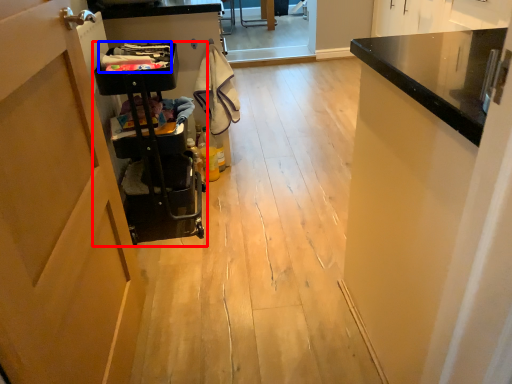
Question: Which object is further to the camera taking this photo, trolley (highlighted by a red box) or laundry (highlighted by a blue box)?

Choices:
 (A) trolley
 (B) laundry

Answer: (B)